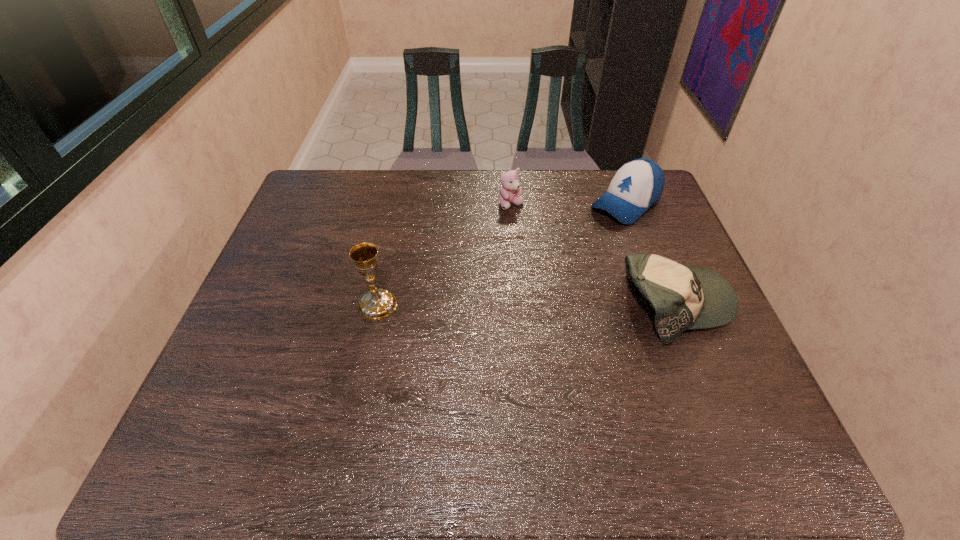
You are a GUI agent. You are given a task and a screenshot of the screen. Output one action in this format:
    pyautogui.click(x=<x>, y=<y>)
    Task: Click on the vacant space located 0.220m at the face of the teddy bear
    
    Given the screenshot: What is the action you would take?
    pyautogui.click(x=537, y=260)

The image size is (960, 540). I want to click on vacant space positioned at the face of the teddy bear, so click(x=530, y=246).

Image resolution: width=960 pixels, height=540 pixels. Identify the location of baseball cap present at the far edge. [637, 185].

Identify the location of teddy bear that is at the far edge. This screenshot has height=540, width=960. (509, 191).

I want to click on object that is at the far right corner, so click(x=637, y=185).

Locate an element on the screen. Image resolution: width=960 pixels, height=540 pixels. vacant space at the far edge of the desktop is located at coordinates coord(391,180).

In the image, there is a desktop. At what (x,y) coordinates should I click in order to perform the action: click on vacant space at the left edge. Please return your answer as a coordinate pair (x, y). The height and width of the screenshot is (540, 960). Looking at the image, I should click on (323, 258).

In order to click on vacant space at the right edge of the desktop in this screenshot , I will do `click(689, 265)`.

You are a GUI agent. You are given a task and a screenshot of the screen. Output one action in this format:
    pyautogui.click(x=<x>, y=<y>)
    Task: Click on the blank space at the near left corner
    Image resolution: width=960 pixels, height=540 pixels.
    Given the screenshot: What is the action you would take?
    pyautogui.click(x=251, y=381)

Where is `vacant space at the near right corner of the desktop`? This screenshot has height=540, width=960. vacant space at the near right corner of the desktop is located at coordinates (722, 400).